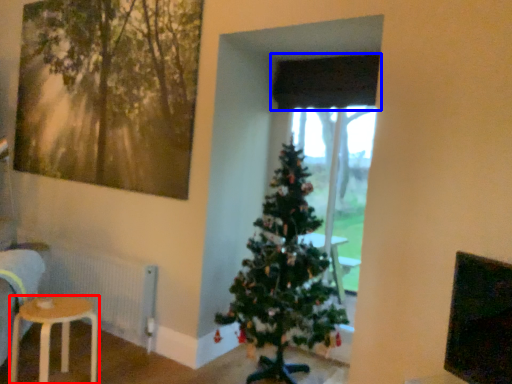
Question: Which point is closer to the camera, stool (highlighted by a red box) or curtain (highlighted by a blue box)?

Choices:
 (A) stool
 (B) curtain

Answer: (A)